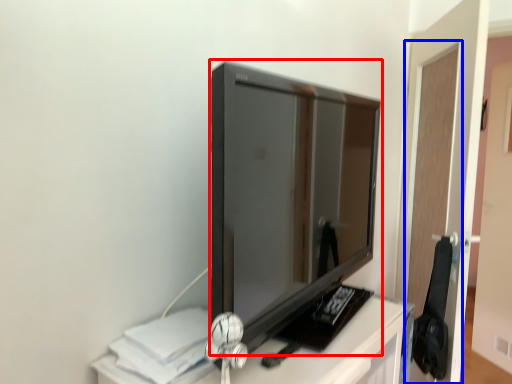
Question: Which point is closer to the camera, television (highlighted by a red box) or glass door (highlighted by a blue box)?

Choices:
 (A) television
 (B) glass door

Answer: (A)